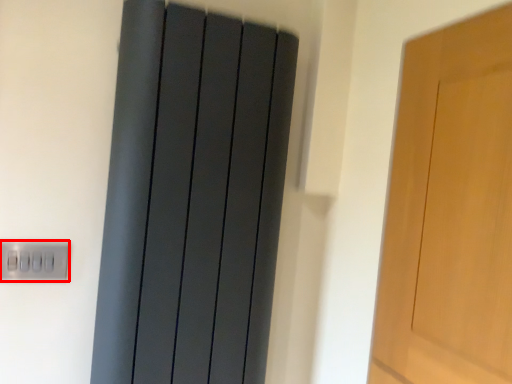
Question: From the image's perspective, considering the relative positions of electric outlet (annotated by the red box) and curtain in the image provided, where is electric outlet (annotated by the red box) located with respect to the staircase?

Choices:
 (A) below
 (B) above

Answer: (A)